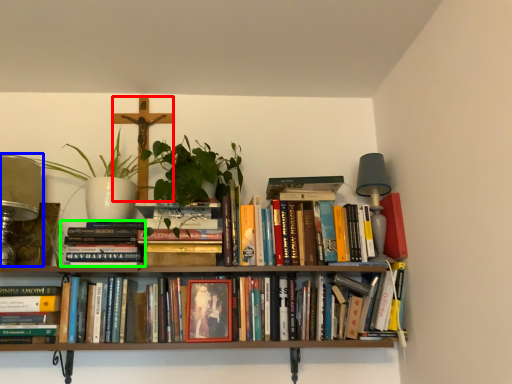
Question: Based on their relative distances, which object is nearer to crucifix (highlighted by a red box)? Choose from table lamp (highlighted by a blue box) and book (highlighted by a green box).

Choices:
 (A) table lamp
 (B) book

Answer: (B)